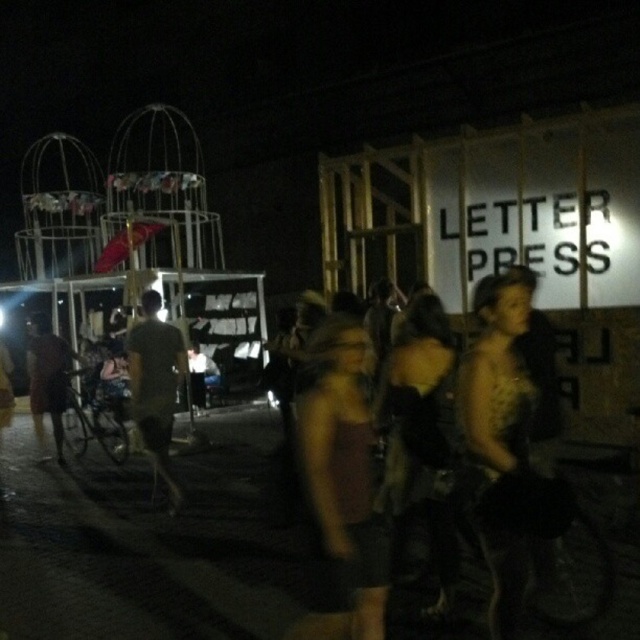
Question: Is matte brown dress at center to the right of gray matte t-shirt at center from the viewer's perspective?

Choices:
 (A) no
 (B) yes

Answer: (B)

Question: Which point is closer to the camera?

Choices:
 (A) matte black dress at center
 (B) gray matte t-shirt at center
 (C) brown fabric dress at left

Answer: (A)

Question: Can you confirm if gray matte t-shirt at center is positioned to the right of brown fabric dress at left?

Choices:
 (A) yes
 (B) no

Answer: (A)

Question: Considering the relative positions of matte black dress at center and gray matte t-shirt at center in the image provided, where is matte black dress at center located with respect to gray matte t-shirt at center?

Choices:
 (A) below
 (B) above

Answer: (B)

Question: Which of the following is the closest to the observer?

Choices:
 (A) (323, 449)
 (B) (460, 372)
 (C) (45, 378)
 (D) (168, 372)

Answer: (A)

Question: Which object appears closest to the camera in this image?

Choices:
 (A) gray matte t-shirt at center
 (B) brown fabric dress at left

Answer: (A)